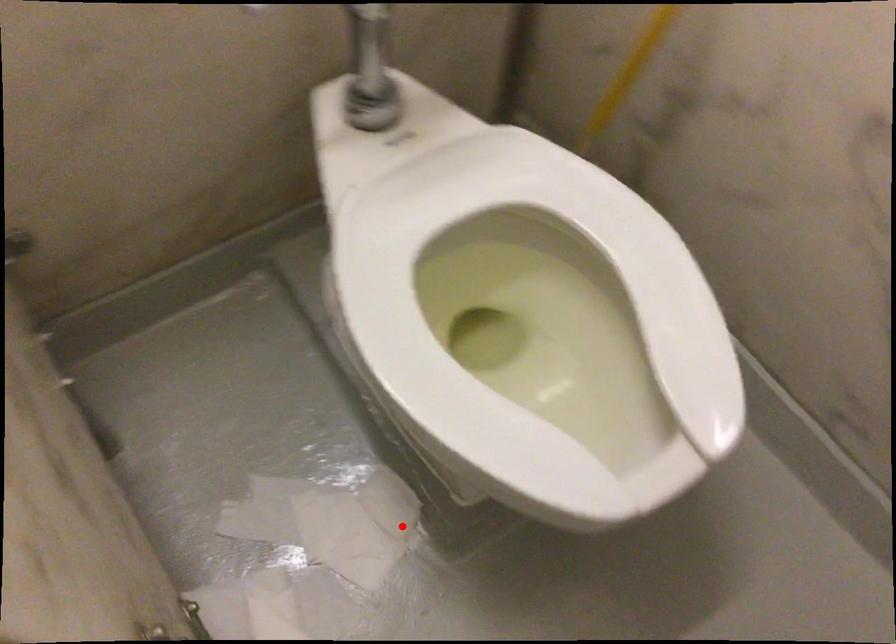
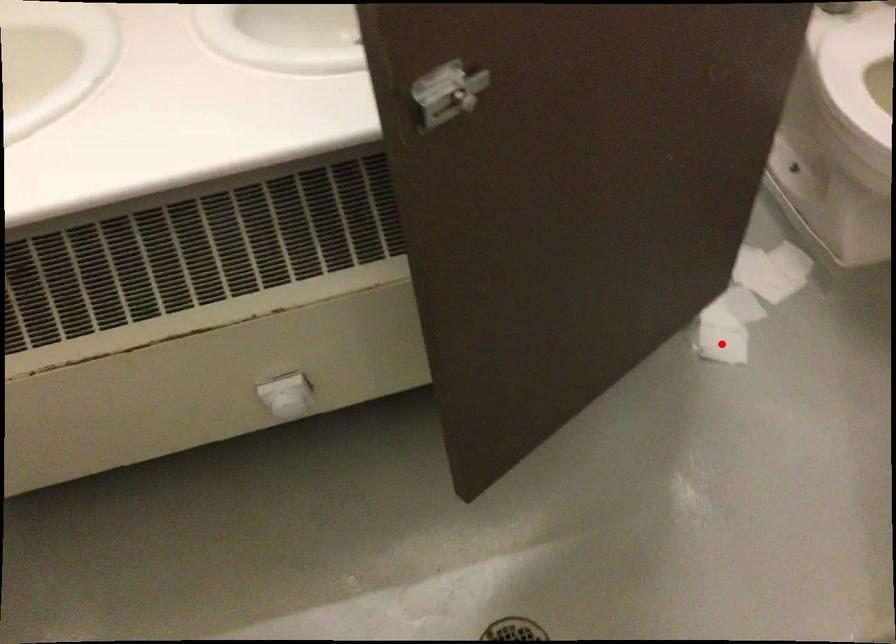
I am providing you with two images of the same scene from different viewpoints. A red point is marked on the first image and another point is marked on the second image. Are the points marked in image1 and image2 representing the same 3D position?

No